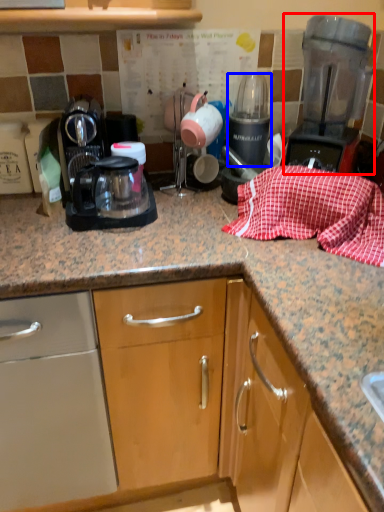
Question: Which object is closer to the camera taking this photo, home appliance (highlighted by a red box) or appliance (highlighted by a blue box)?

Choices:
 (A) home appliance
 (B) appliance

Answer: (A)